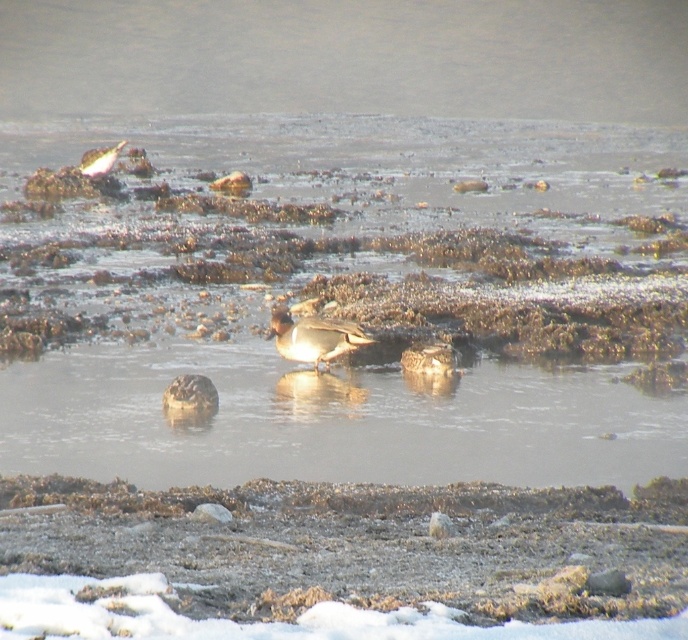
You are a photographer trying to capture the brown feathered duck at upper left and the clear water at center in the same frame. Based on their positions, which object is positioned closer to the camera?

The brown feathered duck at upper left is closer to the camera than the clear water at center because it is placed at the upper left, which typically indicates a closer proximity in such compositions.

You are an environmental scientist observing the scene. You need to determine which area has a larger surface area between the clear water at center and the brown speckled duck at center. Which one has a larger surface area?

The clear water at center has a larger surface area than the brown speckled duck at center, as stated in the description.